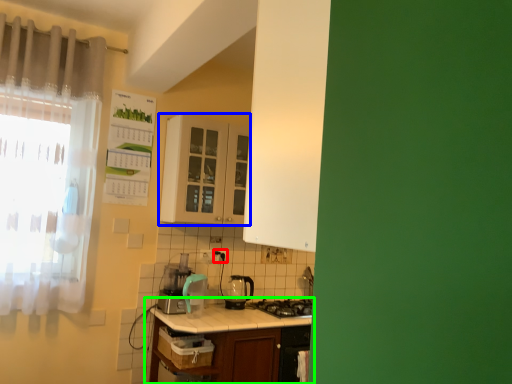
Question: Estimate the real-world distances between objects in this image. Which object is farther from electric outlet (highlighted by a red box), cabinetry (highlighted by a blue box) or table (highlighted by a green box)?

Choices:
 (A) cabinetry
 (B) table

Answer: (B)